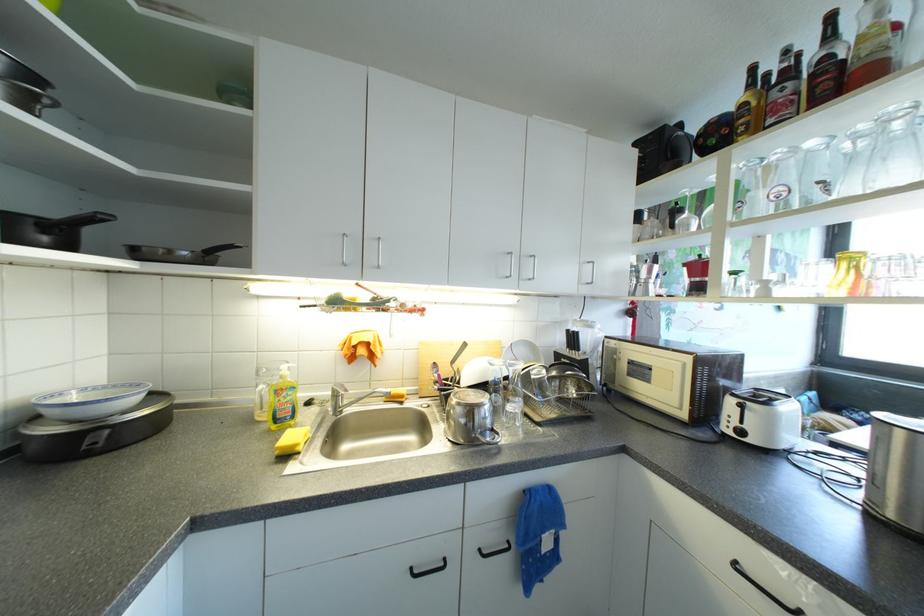
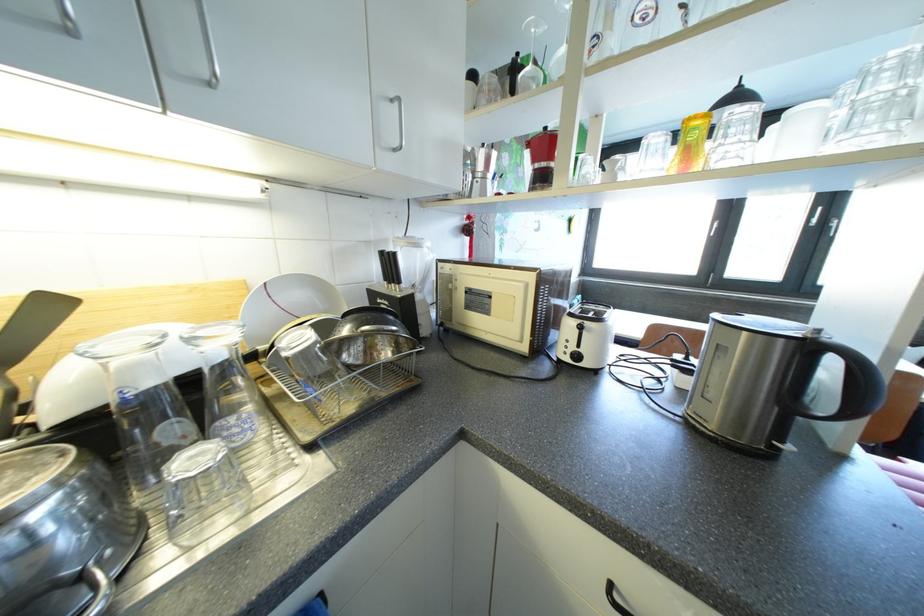
Locate, in the second image, the point that corresponds to (x=703, y=282) in the first image.

(549, 168)